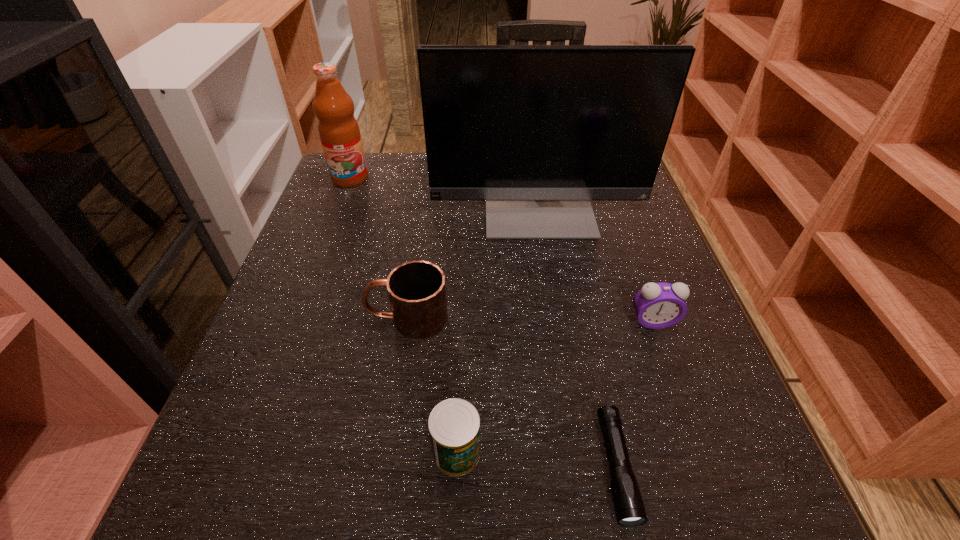
Identify the location of vacant position located on the side of the mug with the handle. The width and height of the screenshot is (960, 540). (330, 318).

The width and height of the screenshot is (960, 540). I want to click on vacant region located on the side of the mug with the handle, so click(324, 318).

This screenshot has width=960, height=540. Find the location of `free space located on the face of the alarm clock`. free space located on the face of the alarm clock is located at coordinates (x=667, y=361).

Where is `vacant space located 0.300m on the left of the can`? vacant space located 0.300m on the left of the can is located at coordinates (234, 453).

Find the location of a particular element. This screenshot has height=540, width=960. computer monitor that is at the far edge is located at coordinates (537, 131).

The image size is (960, 540). Identify the location of fruit juice located in the far edge section of the desktop. (339, 132).

The height and width of the screenshot is (540, 960). Find the location of `can at the near edge`. can at the near edge is located at coordinates (454, 424).

Find the location of a particular element. flashlight that is positioned at the near edge is located at coordinates coord(628,504).

Find the location of `object positioned at the left edge`. object positioned at the left edge is located at coordinates coord(339,132).

The height and width of the screenshot is (540, 960). I want to click on computer monitor present at the right edge, so (537, 131).